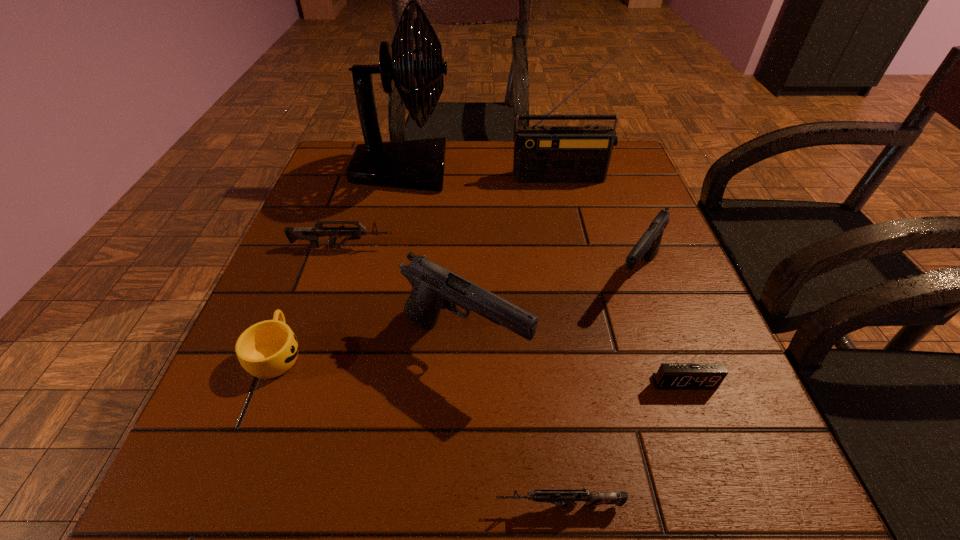
At what (x,y) coordinates should I click in order to perform the action: click on object that stands as the fifth closest to the bigger grey gun. Please return your answer as a coordinate pair (x, y). Looking at the image, I should click on (648, 245).

Locate which gun ranks second in proximity to the radio receiver. Please provide its 2D coordinates. Your answer should be formatted as a tuple, i.e. [(x, y)], where the tuple contains the x and y coordinates of a point satisfying the conditions above.

[(312, 234)]

Locate an element on the screen. The height and width of the screenshot is (540, 960). gun that is the closest to the fan is located at coordinates (312, 234).

Identify the location of vacant space that satisfies the following two spatial constraints: 1. on the front-facing side of the alarm clock; 2. aimed along the barrel of the nearer grey gun. (730, 505).

Image resolution: width=960 pixels, height=540 pixels. What are the coordinates of `vacant space that satisfies the following two spatial constraints: 1. on the front-facing side of the alarm clock; 2. aimed along the barrel of the nearest object` in the screenshot? It's located at (730, 505).